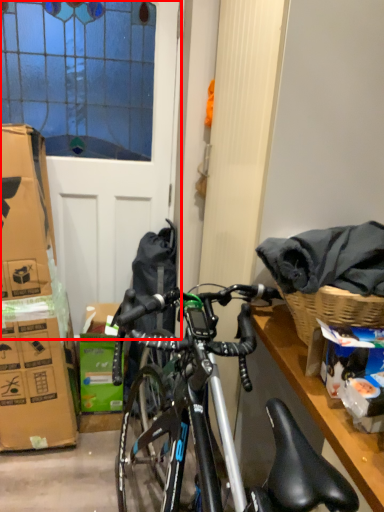
Question: From the image's perspective, where is screen door (annotated by the red box) located in relation to box in the image?

Choices:
 (A) above
 (B) below

Answer: (A)